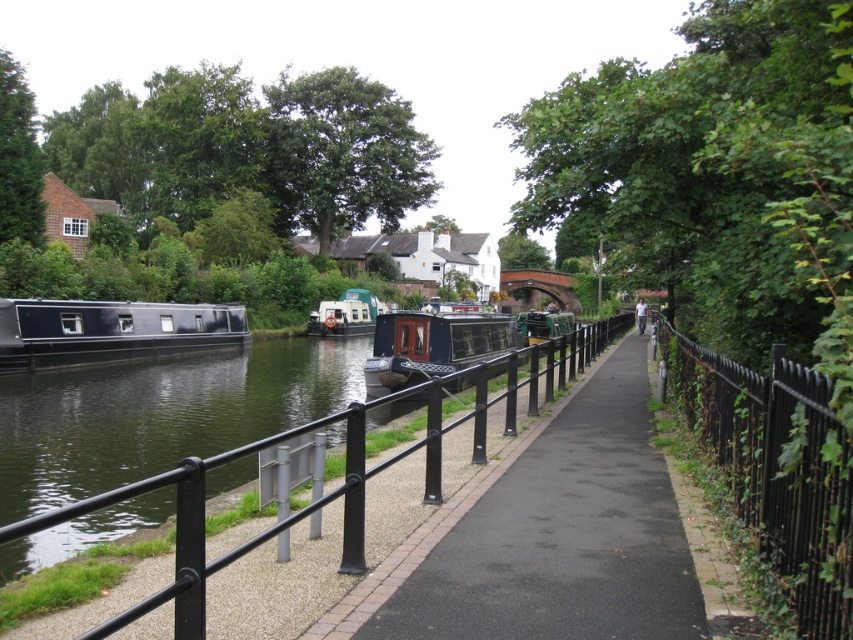
You are standing at the edge of the canal pathway and want to take a photo of the black wrought iron fence at right. If your camera can focus on objects up to 10 feet away, will you need to move closer or farther away to capture a clear image?

The black wrought iron fence at right is 9.65 feet away from the camera, which is within the camera focus range of up to 10 feet. Therefore, you do not need to move closer or farther away to capture a clear image.